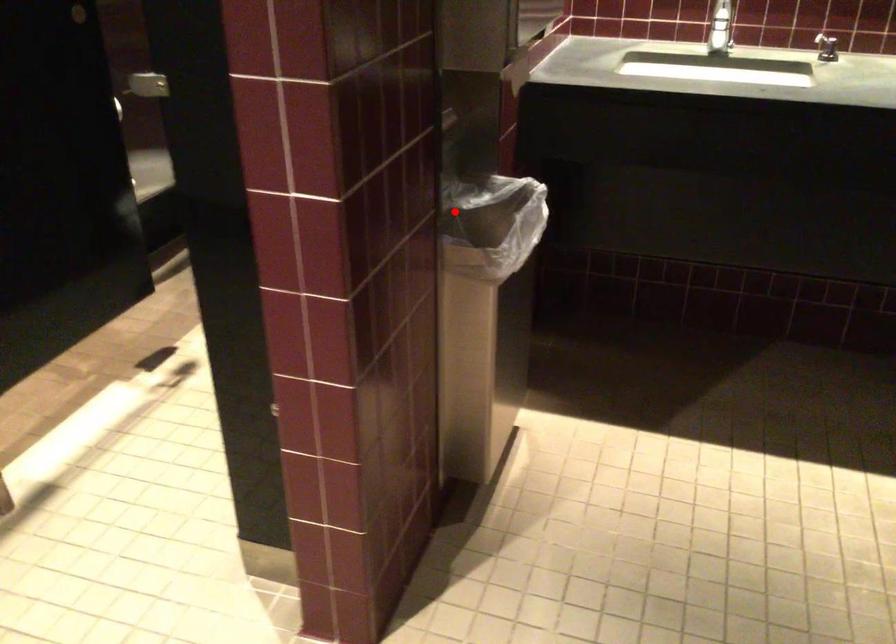
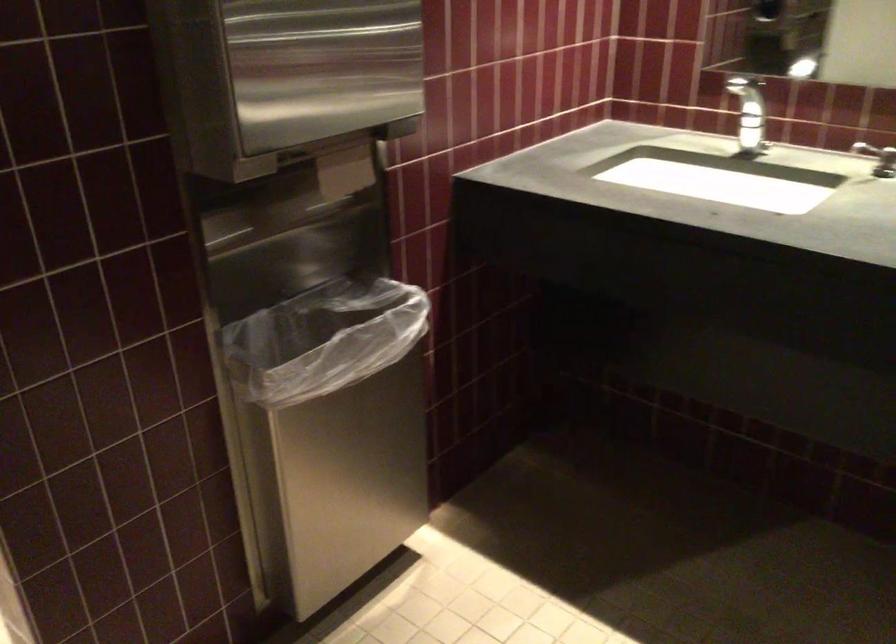
The point at the highlighted location is marked in the first image. Where is the corresponding point in the second image?

(326, 315)